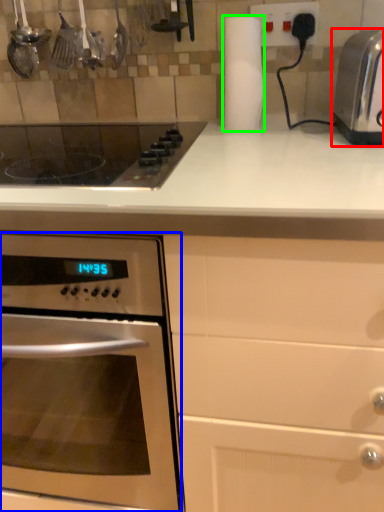
Question: Based on their relative distances, which object is nearer to toaster (highlighted by a red box)? Choose from oven (highlighted by a blue box) and paper towel (highlighted by a green box).

Choices:
 (A) oven
 (B) paper towel

Answer: (B)